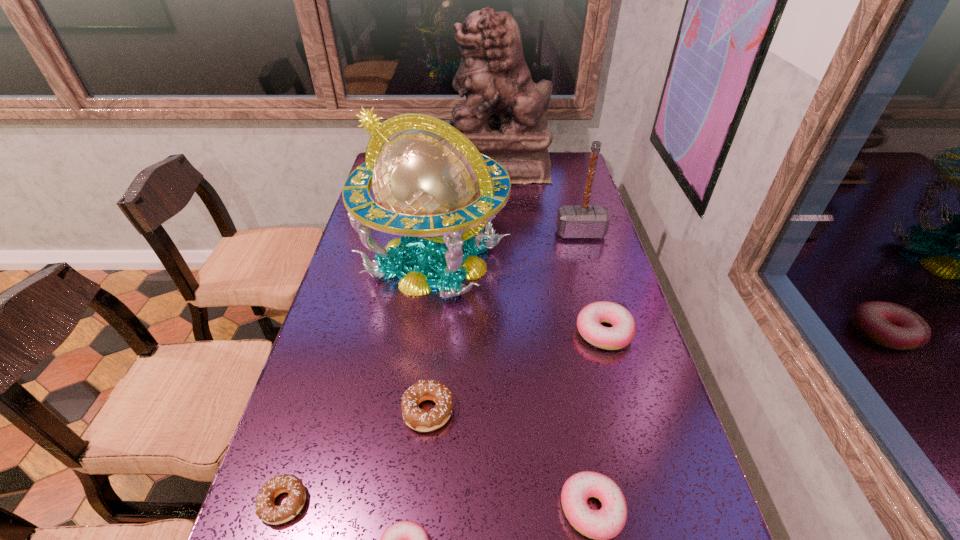
Where is `the left chocolate doughnut`? Image resolution: width=960 pixels, height=540 pixels. the left chocolate doughnut is located at coordinates (265, 509).

At what (x,y) coordinates should I click in order to perform the action: click on free region located on the front-facing side of the farthest object. Please return your answer as a coordinate pair (x, y). This screenshot has height=540, width=960. Looking at the image, I should click on (403, 167).

Locate an element on the screen. vacant space located 0.240m on the front-facing side of the farthest object is located at coordinates (389, 167).

The width and height of the screenshot is (960, 540). What are the coordinates of `free space located on the front-facing side of the farthest object` in the screenshot? It's located at (408, 167).

Locate an element on the screen. The width and height of the screenshot is (960, 540). vacant space located on the back of the globe is located at coordinates click(x=444, y=178).

The height and width of the screenshot is (540, 960). Find the location of `free region located on the striking surface of the sixth shortest object`. free region located on the striking surface of the sixth shortest object is located at coordinates pos(592,276).

You are a GUI agent. You are given a task and a screenshot of the screen. Output one action in this format:
    pyautogui.click(x=<x>, y=<y>)
    Task: Click on the free region located 0.170m on the left of the farthest pink doughnut
    The height and width of the screenshot is (540, 960).
    Given the screenshot: What is the action you would take?
    pyautogui.click(x=511, y=332)

Where is `vacant space located on the right of the right chocolate doughnut`? The height and width of the screenshot is (540, 960). vacant space located on the right of the right chocolate doughnut is located at coordinates (629, 411).

Identify the location of vacant point located on the back of the nearer chocolate doughnut. The image size is (960, 540). (315, 404).

Identify the location of object positioned at the far edge. (504, 115).